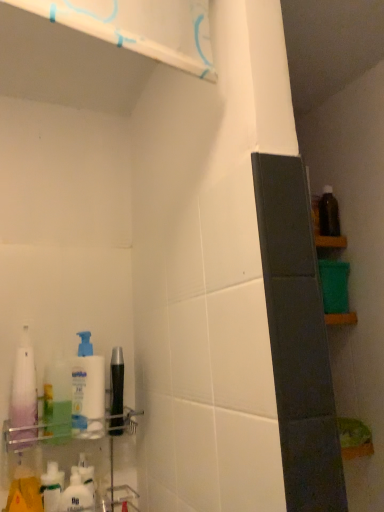
The height and width of the screenshot is (512, 384). What do you see at coordinates (57, 400) in the screenshot? I see `white glossy pump bottle at left, which is the second cleaning product in left-to-right order` at bounding box center [57, 400].

Locate an element on the screen. white matte pump bottle at left, positioned as the 3th cleaning product in left-to-right order is located at coordinates 88,390.

Locate an element on the screen. translucent purple bottle at left, which is counted as the first cleaning product, starting from the left is located at coordinates (24, 394).

Identify the location of clear plastic shelf at lower left, the 1th shelf positioned from the back. The height and width of the screenshot is (512, 384). (69, 465).

Could you tell me if white matte pump bottle at left, positioned as the 3th cleaning product in left-to-right order, is facing white glossy shelf at upper left, the second shelf in the back-to-front sequence?

No, white matte pump bottle at left, positioned as the 3th cleaning product in left-to-right order, does not turn towards white glossy shelf at upper left, the second shelf in the back-to-front sequence.

From the image's perspective, is white matte pump bottle at left, the first cleaning product positioned from the right, on top of white glossy shelf at upper left, the second shelf in the back-to-front sequence?

No, from the image's perspective, white matte pump bottle at left, the first cleaning product positioned from the right, is not on top of white glossy shelf at upper left, the second shelf in the back-to-front sequence.

Considering the positions of objects white matte pump bottle at left, positioned as the 3th cleaning product in left-to-right order, and white glossy shelf at upper left, the 2th shelf ordered from the bottom, in the image provided, who is more to the left, white matte pump bottle at left, positioned as the 3th cleaning product in left-to-right order, or white glossy shelf at upper left, the 2th shelf ordered from the bottom,?

Positioned to the left is white matte pump bottle at left, positioned as the 3th cleaning product in left-to-right order.

Considering the sizes of objects white matte pump bottle at left, positioned as the 3th cleaning product in left-to-right order, and white glossy shelf at upper left, which is counted as the first shelf, starting from the front, in the image provided, who is bigger, white matte pump bottle at left, positioned as the 3th cleaning product in left-to-right order, or white glossy shelf at upper left, which is counted as the first shelf, starting from the front,?

white glossy shelf at upper left, which is counted as the first shelf, starting from the front, is bigger.

Between white glossy shelf at upper left, the 2th shelf ordered from the bottom, and white glossy lotion at lower left, which one appears on the right side from the viewer's perspective?

white glossy shelf at upper left, the 2th shelf ordered from the bottom.

From the image's perspective, does white glossy shelf at upper left, the 2th shelf ordered from the bottom, appear higher than white glossy lotion at lower left?

Indeed, from the image's perspective, white glossy shelf at upper left, the 2th shelf ordered from the bottom, is shown above white glossy lotion at lower left.

Between white glossy shelf at upper left, the second shelf in the back-to-front sequence, and white glossy lotion at lower left, which one is positioned in front?

white glossy shelf at upper left, the second shelf in the back-to-front sequence, is in front.

From their relative heights in the image, would you say white glossy shelf at upper left, the 2th shelf ordered from the bottom, is taller or shorter than white glossy lotion at lower left?

In the image, white glossy shelf at upper left, the 2th shelf ordered from the bottom, appears to be taller than white glossy lotion at lower left.

In terms of size, does white glossy shelf at upper left, the first shelf from the top, appear bigger or smaller than white matte pump bottle at left, the first cleaning product positioned from the right?

white glossy shelf at upper left, the first shelf from the top, is bigger than white matte pump bottle at left, the first cleaning product positioned from the right.

In terms of width, does white glossy shelf at upper left, which is counted as the first shelf, starting from the front, look wider or thinner when compared to white matte pump bottle at left, the first cleaning product positioned from the right?

Considering their sizes, white glossy shelf at upper left, which is counted as the first shelf, starting from the front, looks slimmer than white matte pump bottle at left, the first cleaning product positioned from the right.

Considering the relative positions of white glossy shelf at upper left, the first shelf from the top, and white matte pump bottle at left, the first cleaning product positioned from the right, in the image provided, is white glossy shelf at upper left, the first shelf from the top, to the right of white matte pump bottle at left, the first cleaning product positioned from the right, from the viewer's perspective?

Indeed, white glossy shelf at upper left, the first shelf from the top, is positioned on the right side of white matte pump bottle at left, the first cleaning product positioned from the right.

Is translucent purple bottle at left, which is counted as the first cleaning product, starting from the left, beside white glossy lotion at lower left?

No, translucent purple bottle at left, which is counted as the first cleaning product, starting from the left, is not next to white glossy lotion at lower left.

From the image's perspective, which is below, translucent purple bottle at left, which is counted as the first cleaning product, starting from the left, or white glossy lotion at lower left?

From the image's view, white glossy lotion at lower left is below.

Is translucent purple bottle at left, marked as the 3th cleaning product in a right-to-left arrangement, smaller than white glossy lotion at lower left?

No.

Could you tell me if translucent purple bottle at left, marked as the 3th cleaning product in a right-to-left arrangement, is facing white glossy lotion at lower left?

No, translucent purple bottle at left, marked as the 3th cleaning product in a right-to-left arrangement, is not oriented towards white glossy lotion at lower left.

Based on the photo, does clear plastic shelf at lower left, arranged as the 1th shelf when ordered from the bottom, turn towards white glossy pump bottle at left, arranged as the 2th cleaning product when viewed from the right?

No, clear plastic shelf at lower left, arranged as the 1th shelf when ordered from the bottom, is not turned towards white glossy pump bottle at left, arranged as the 2th cleaning product when viewed from the right.

From the image's perspective, is clear plastic shelf at lower left, positioned as the second shelf in top-to-bottom order, above or below white glossy pump bottle at left, which is the second cleaning product in left-to-right order?

Based on their image positions, clear plastic shelf at lower left, positioned as the second shelf in top-to-bottom order, is located beneath white glossy pump bottle at left, which is the second cleaning product in left-to-right order.

Between clear plastic shelf at lower left, positioned as the second shelf in top-to-bottom order, and white glossy pump bottle at left, arranged as the 2th cleaning product when viewed from the right, which one has smaller size?

white glossy pump bottle at left, arranged as the 2th cleaning product when viewed from the right.

What are the coordinates of `shelf that is the 1st one when counting forward from the white glossy pump bottle at left, which is the second cleaning product in left-to-right order` in the screenshot? It's located at (69, 465).

Does point (48, 368) come in front of point (59, 493)?

No, it is behind (59, 493).

Which object is closer to the camera, white glossy pump bottle at left, which is the second cleaning product in left-to-right order, or clear plastic shelf at lower left, arranged as the 1th shelf when ordered from the bottom?

clear plastic shelf at lower left, arranged as the 1th shelf when ordered from the bottom, is closer to the camera.

Considering the sizes of objects white glossy pump bottle at left, which is the second cleaning product in left-to-right order, and clear plastic shelf at lower left, the 1th shelf positioned from the back, in the image provided, who is wider, white glossy pump bottle at left, which is the second cleaning product in left-to-right order, or clear plastic shelf at lower left, the 1th shelf positioned from the back,?

Wider between the two is clear plastic shelf at lower left, the 1th shelf positioned from the back.

Considering the relative sizes of white glossy pump bottle at left, which is the second cleaning product in left-to-right order, and clear plastic shelf at lower left, arranged as the 1th shelf when ordered from the bottom, in the image provided, is white glossy pump bottle at left, which is the second cleaning product in left-to-right order, taller than clear plastic shelf at lower left, arranged as the 1th shelf when ordered from the bottom,?

In fact, white glossy pump bottle at left, which is the second cleaning product in left-to-right order, may be shorter than clear plastic shelf at lower left, arranged as the 1th shelf when ordered from the bottom.

From the image's perspective, which one is positioned lower, translucent purple bottle at left, marked as the 3th cleaning product in a right-to-left arrangement, or clear plastic shelf at lower left, positioned as the second shelf in top-to-bottom order?

clear plastic shelf at lower left, positioned as the second shelf in top-to-bottom order, is shown below in the image.

In the scene shown: From a real-world perspective, is translucent purple bottle at left, which is counted as the first cleaning product, starting from the left, beneath clear plastic shelf at lower left, positioned as the second shelf in top-to-bottom order?

No, from a real-world perspective, translucent purple bottle at left, which is counted as the first cleaning product, starting from the left, is not below clear plastic shelf at lower left, positioned as the second shelf in top-to-bottom order.

Does translucent purple bottle at left, which is counted as the first cleaning product, starting from the left, turn towards clear plastic shelf at lower left, the second shelf from the front?

No, translucent purple bottle at left, which is counted as the first cleaning product, starting from the left, is not aimed at clear plastic shelf at lower left, the second shelf from the front.

Based on their sizes in the image, would you say translucent purple bottle at left, marked as the 3th cleaning product in a right-to-left arrangement, is bigger or smaller than clear plastic shelf at lower left, the second shelf from the front?

Considering their sizes, translucent purple bottle at left, marked as the 3th cleaning product in a right-to-left arrangement, takes up less space than clear plastic shelf at lower left, the second shelf from the front.

Starting from the white glossy shelf at upper left, the first shelf from the top, which cleaning product is the 3rd one behind? Please provide its 2D coordinates.

[(88, 390)]

The width and height of the screenshot is (384, 512). Identify the location of the 2nd shelf to the right when counting from the white glossy lotion at lower left. (140, 27).

From the image, which object appears to be nearer to white glossy shelf at upper left, the first shelf from the top, white matte pump bottle at left, positioned as the 3th cleaning product in left-to-right order, or white glossy lotion at lower left?

white matte pump bottle at left, positioned as the 3th cleaning product in left-to-right order, is closer to white glossy shelf at upper left, the first shelf from the top.

From the image, which object appears to be farther from translucent purple bottle at left, marked as the 3th cleaning product in a right-to-left arrangement, white glossy pump bottle at left, arranged as the 2th cleaning product when viewed from the right, or white matte pump bottle at left, the first cleaning product positioned from the right?

white matte pump bottle at left, the first cleaning product positioned from the right.

Based on their spatial positions, is translucent purple bottle at left, marked as the 3th cleaning product in a right-to-left arrangement, or white matte pump bottle at left, the first cleaning product positioned from the right, further from white glossy pump bottle at left, arranged as the 2th cleaning product when viewed from the right?

Among the two, translucent purple bottle at left, marked as the 3th cleaning product in a right-to-left arrangement, is located further to white glossy pump bottle at left, arranged as the 2th cleaning product when viewed from the right.

Looking at the image, which one is located closer to white glossy lotion at lower left, white glossy pump bottle at left, arranged as the 2th cleaning product when viewed from the right, or white matte pump bottle at left, the first cleaning product positioned from the right?

The object closer to white glossy lotion at lower left is white glossy pump bottle at left, arranged as the 2th cleaning product when viewed from the right.

Looking at the image, which one is located closer to translucent purple bottle at left, marked as the 3th cleaning product in a right-to-left arrangement, white glossy lotion at lower left or white matte pump bottle at left, positioned as the 3th cleaning product in left-to-right order?

Based on the image, white matte pump bottle at left, positioned as the 3th cleaning product in left-to-right order, appears to be nearer to translucent purple bottle at left, marked as the 3th cleaning product in a right-to-left arrangement.

Looking at the image, which one is located closer to translucent purple bottle at left, which is counted as the first cleaning product, starting from the left, white glossy shelf at upper left, the 2th shelf ordered from the bottom, or white matte pump bottle at left, the first cleaning product positioned from the right?

white matte pump bottle at left, the first cleaning product positioned from the right, lies closer to translucent purple bottle at left, which is counted as the first cleaning product, starting from the left, than the other object.

Based on their spatial positions, is white glossy pump bottle at left, which is the second cleaning product in left-to-right order, or white glossy shelf at upper left, the second shelf in the back-to-front sequence, further from translucent purple bottle at left, which is counted as the first cleaning product, starting from the left?

white glossy shelf at upper left, the second shelf in the back-to-front sequence, lies further to translucent purple bottle at left, which is counted as the first cleaning product, starting from the left, than the other object.

Which object lies further to the anchor point white glossy lotion at lower left, white matte pump bottle at left, the first cleaning product positioned from the right, or translucent purple bottle at left, marked as the 3th cleaning product in a right-to-left arrangement?

white matte pump bottle at left, the first cleaning product positioned from the right.

At what (x,y) coordinates should I click in order to perform the action: click on shelf between white glossy shelf at upper left, the second shelf in the back-to-front sequence, and white glossy lotion at lower left from top to bottom. Please return your answer as a coordinate pair (x, y). This screenshot has height=512, width=384. Looking at the image, I should click on coord(69,465).

Locate an element on the screen. shelf between translucent purple bottle at left, marked as the 3th cleaning product in a right-to-left arrangement, and white glossy lotion at lower left, in the vertical direction is located at coordinates (69, 465).

I want to click on shelf that lies between white glossy pump bottle at left, which is the second cleaning product in left-to-right order, and white glossy lotion at lower left from top to bottom, so click(x=69, y=465).

Locate an element on the screen. The width and height of the screenshot is (384, 512). cleaning product that lies between white glossy pump bottle at left, arranged as the 2th cleaning product when viewed from the right, and white glossy lotion at lower left from top to bottom is located at coordinates (88, 390).